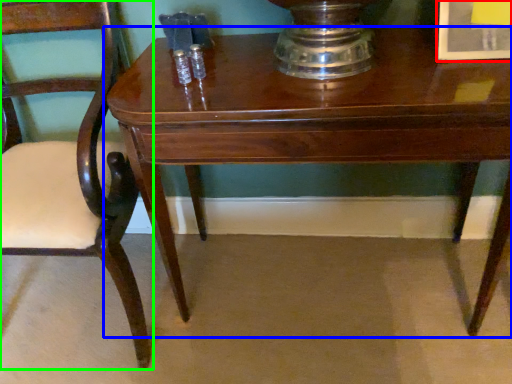
Question: Which object is positioned closest to picture frame (highlighted by a red box)? Select from table (highlighted by a blue box) and chair (highlighted by a green box).

Choices:
 (A) table
 (B) chair

Answer: (A)